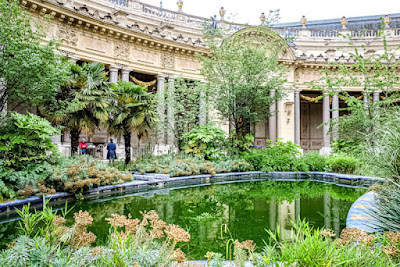
The width and height of the screenshot is (400, 267). In order to click on possible apron in this screenshot , I will do `click(107, 154)`.